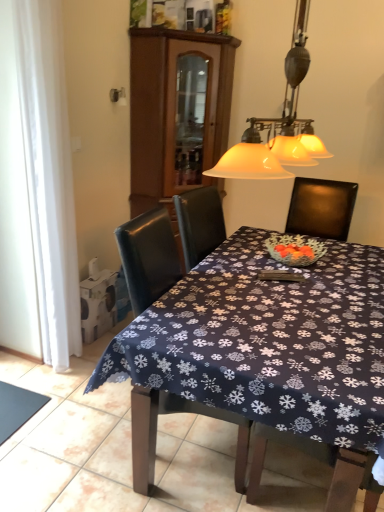
This screenshot has height=512, width=384. I want to click on free space between white sheer curtain at left and dark blue fabric at lower left, so [x=44, y=378].